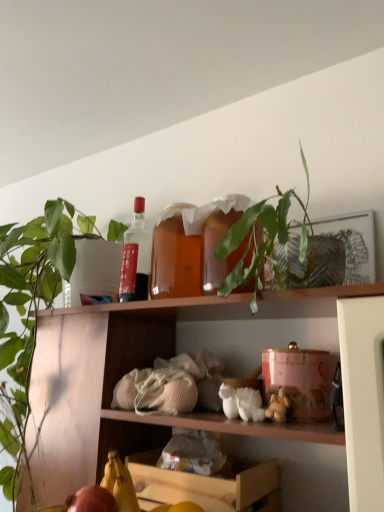
This screenshot has height=512, width=384. In order to click on wooden crate at lower center in this screenshot , I will do `click(207, 484)`.

In order to click on green matte plant at upper left in this screenshot , I will do `click(32, 310)`.

Identify the location of matte red apple at lower left. (92, 500).

Measure the distance between point (x=123, y=481) and camera.

They are 35.79 inches apart.

Identify the location of wooden crate at lower center. (207, 484).

Between yellow matte banana at lower left and green matte plant at upper left, which one has smaller size?

Smaller between the two is yellow matte banana at lower left.

From a real-world perspective, is yellow matte banana at lower left beneath green matte plant at upper left?

Yes.

Can you confirm if yellow matte banana at lower left is wider than green matte plant at upper left?

No, yellow matte banana at lower left is not wider than green matte plant at upper left.

Can you tell me how much yellow matte banana at lower left and green matte plant at upper left differ in facing direction?

4.78 degrees.

Which object is further away from the camera taking this photo, wooden crate at lower center or green leafy plant at upper center?

wooden crate at lower center is further away from the camera.

Considering the relative positions of wooden crate at lower center and green leafy plant at upper center in the image provided, is wooden crate at lower center to the right of green leafy plant at upper center from the viewer's perspective?

No.

Is wooden crate at lower center inside or outside of green leafy plant at upper center?

wooden crate at lower center is outside green leafy plant at upper center.

Does point (219, 511) lie behind point (279, 269)?

Yes, point (219, 511) is behind point (279, 269).

Can you confirm if green leafy plant at upper center is taller than green matte plant at upper left?

No, green leafy plant at upper center is not taller than green matte plant at upper left.

Is green leafy plant at upper center at the left side of green matte plant at upper left?

Incorrect, green leafy plant at upper center is not on the left side of green matte plant at upper left.

Can you confirm if green leafy plant at upper center is thinner than green matte plant at upper left?

Yes.

Is point (290, 282) farther from viewer compared to point (27, 379)?

No, (290, 282) is in front of (27, 379).

Which of these two, green leafy plant at upper center or wooden crate at lower center, is thinner?

Thinner between the two is green leafy plant at upper center.

Can you confirm if green leafy plant at upper center is positioned to the left of wooden crate at lower center?

Incorrect, green leafy plant at upper center is not on the left side of wooden crate at lower center.

Which object is further away from the camera taking this photo, green leafy plant at upper center or wooden crate at lower center?

Positioned behind is wooden crate at lower center.

Is green leafy plant at upper center bigger or smaller than wooden crate at lower center?

Considering their sizes, green leafy plant at upper center takes up more space than wooden crate at lower center.

Is yellow matte banana at lower left looking in the opposite direction of matte red apple at lower left?

Yes, yellow matte banana at lower left is facing away from matte red apple at lower left.

Is yellow matte banana at lower left with matte red apple at lower left?

Yes, yellow matte banana at lower left is right next to matte red apple at lower left and making contact.

Looking at this image, which point is more distant from viewer, (106, 475) or (114, 505)?

The point (106, 475) is more distant.

Can you confirm if yellow matte banana at lower left is wider than matte red apple at lower left?

No, yellow matte banana at lower left is not wider than matte red apple at lower left.

From a real-world perspective, between matte glass bottle at upper center and wooden crate at lower center, who is vertically lower?

wooden crate at lower center, from a real-world perspective.

Can you tell me how much matte glass bottle at upper center and wooden crate at lower center differ in facing direction?

There is a 86.9-degree angle between the facing directions of matte glass bottle at upper center and wooden crate at lower center.

From the image's perspective, who appears lower, matte glass bottle at upper center or wooden crate at lower center?

From the image's view, wooden crate at lower center is below.

Is wooden crate at lower center at the back of matte glass bottle at upper center?

No, matte glass bottle at upper center is not facing away from wooden crate at lower center.

Would you consider green matte plant at upper left to be distant from wooden crate at lower center?

green matte plant at upper left is actually quite close to wooden crate at lower center.

Between green matte plant at upper left and wooden crate at lower center, which one appears on the left side from the viewer's perspective?

green matte plant at upper left is more to the left.

Considering the sizes of objects green matte plant at upper left and wooden crate at lower center in the image provided, who is taller, green matte plant at upper left or wooden crate at lower center?

green matte plant at upper left is taller.

The width and height of the screenshot is (384, 512). I want to click on banana in front of the green matte plant at upper left, so click(119, 483).

Find the location of a particular element. shelf on the left side of green leafy plant at upper center is located at coordinates (207, 484).

When comparing their distances from matte glass bottle at upper center, does green matte plant at upper left or matte red apple at lower left seem further?

matte red apple at lower left lies further to matte glass bottle at upper center than the other object.

From the image, which object appears to be nearer to yellow matte banana at lower left, green leafy plant at upper center or matte glass bottle at upper center?

The object closer to yellow matte banana at lower left is green leafy plant at upper center.

Based on their spatial positions, is wooden crate at lower center or matte red apple at lower left further from matte glass bottle at upper center?

Based on the image, matte red apple at lower left appears to be further to matte glass bottle at upper center.

Which object lies nearer to the anchor point green matte plant at upper left, yellow matte banana at lower left or matte red apple at lower left?

yellow matte banana at lower left.

Based on the photo, estimate the real-world distances between objects in this image. Which object is further from yellow matte banana at lower left, wooden crate at lower center or green matte plant at upper left?

green matte plant at upper left is further to yellow matte banana at lower left.

When comparing their distances from matte red apple at lower left, does wooden crate at lower center or yellow matte banana at lower left seem further?

wooden crate at lower center is further to matte red apple at lower left.

From the image, which object appears to be farther from matte glass bottle at upper center, green matte plant at upper left or green leafy plant at upper center?

Based on the image, green leafy plant at upper center appears to be further to matte glass bottle at upper center.

Looking at the image, which one is located closer to wooden crate at lower center, yellow matte banana at lower left or green matte plant at upper left?

yellow matte banana at lower left.

I want to click on apple between green matte plant at upper left and wooden crate at lower center in the horizontal direction, so click(x=92, y=500).

Identify the location of banana between matte red apple at lower left and wooden crate at lower center from left to right. This screenshot has width=384, height=512. (119, 483).

Locate an element on the screen. This screenshot has width=384, height=512. banana that lies between green leafy plant at upper center and wooden crate at lower center from top to bottom is located at coordinates (119, 483).

Find the location of a particular element. This screenshot has height=512, width=384. banana between green matte plant at upper left and green leafy plant at upper center in the horizontal direction is located at coordinates (119, 483).